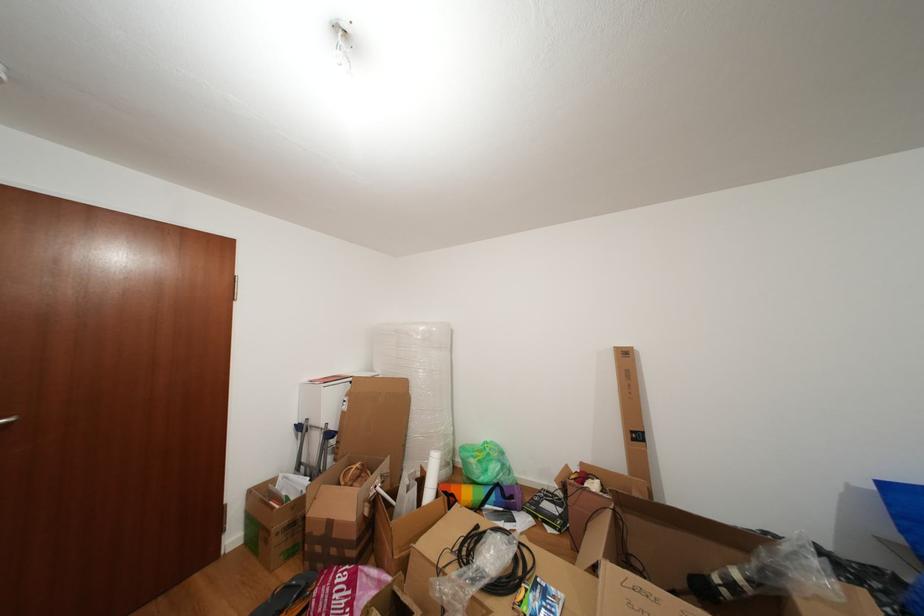
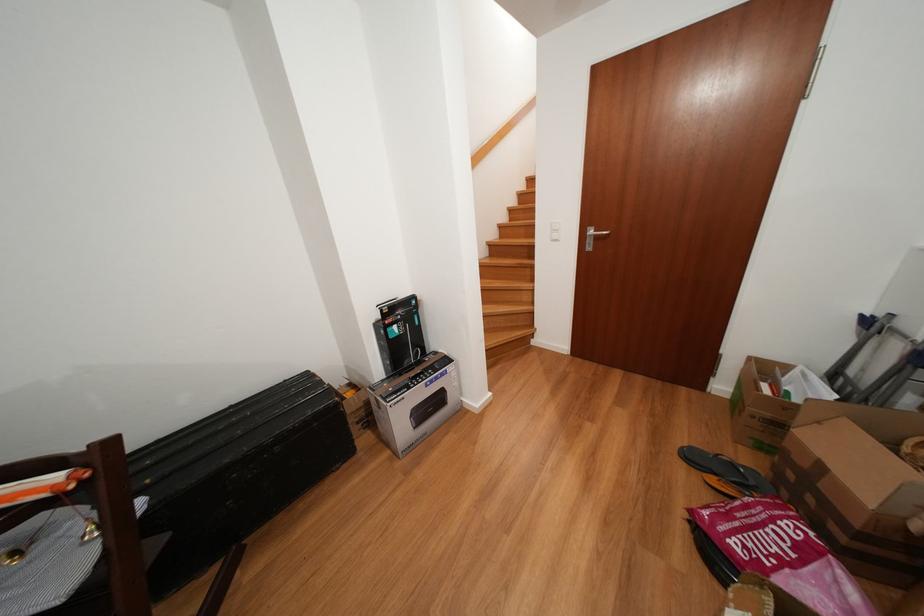
First-person continuous shooting, in which direction is the camera rotating?

The rotation direction of the camera is left-down.